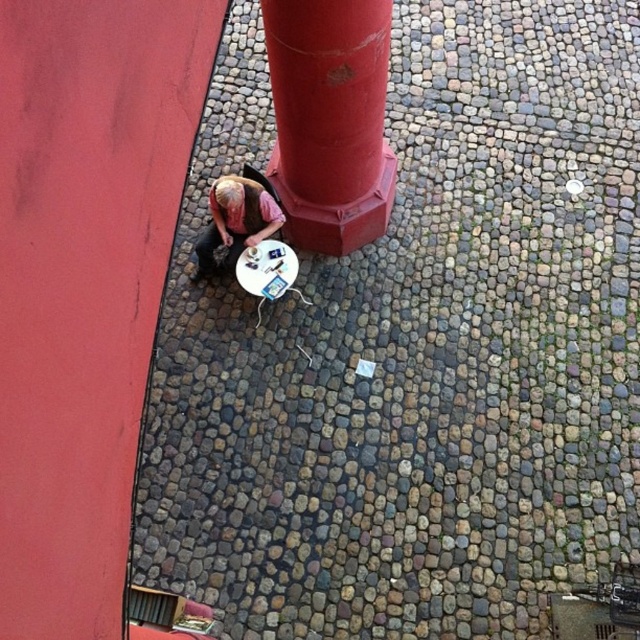
Question: Can you confirm if smooth red pillar at center is positioned to the left of matte pink shirt at center?

Choices:
 (A) no
 (B) yes

Answer: (A)

Question: Does smooth red pillar at center have a lesser width compared to matte pink shirt at center?

Choices:
 (A) no
 (B) yes

Answer: (A)

Question: Which object appears closest to the camera in this image?

Choices:
 (A) matte pink shirt at center
 (B) smooth red pillar at center

Answer: (B)

Question: Which point appears farthest from the camera in this image?

Choices:
 (A) 275,109
 (B) 241,214

Answer: (A)

Question: Is smooth red pillar at center behind matte pink shirt at center?

Choices:
 (A) no
 (B) yes

Answer: (A)